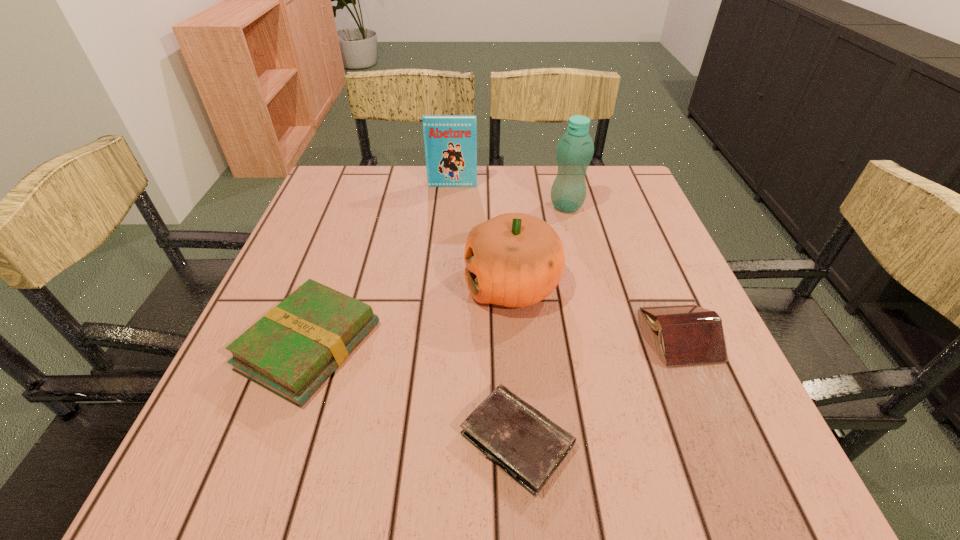
This screenshot has height=540, width=960. Identify the location of vacant space that satisfies the following two spatial constraints: 1. on the face of the rightmost object; 2. on the left side of the fourth shortest object. (516, 335).

Locate an element on the screen. Image resolution: width=960 pixels, height=540 pixels. free space that satisfies the following two spatial constraints: 1. on the face of the pumpkin; 2. on the front side of the leftmost object is located at coordinates (517, 346).

The height and width of the screenshot is (540, 960). Identify the location of vacant space that satisfies the following two spatial constraints: 1. on the front cover of the diary; 2. on the left side of the second book from left to right. (431, 440).